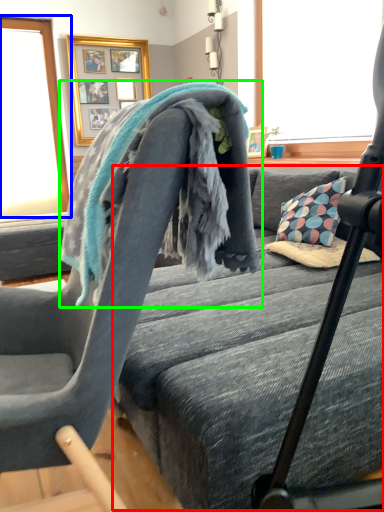
Question: Based on their relative distances, which object is farther from bed frame (highlighted by a red box)? Choose from window screen (highlighted by a blue box) and bath towel (highlighted by a green box).

Choices:
 (A) window screen
 (B) bath towel

Answer: (A)